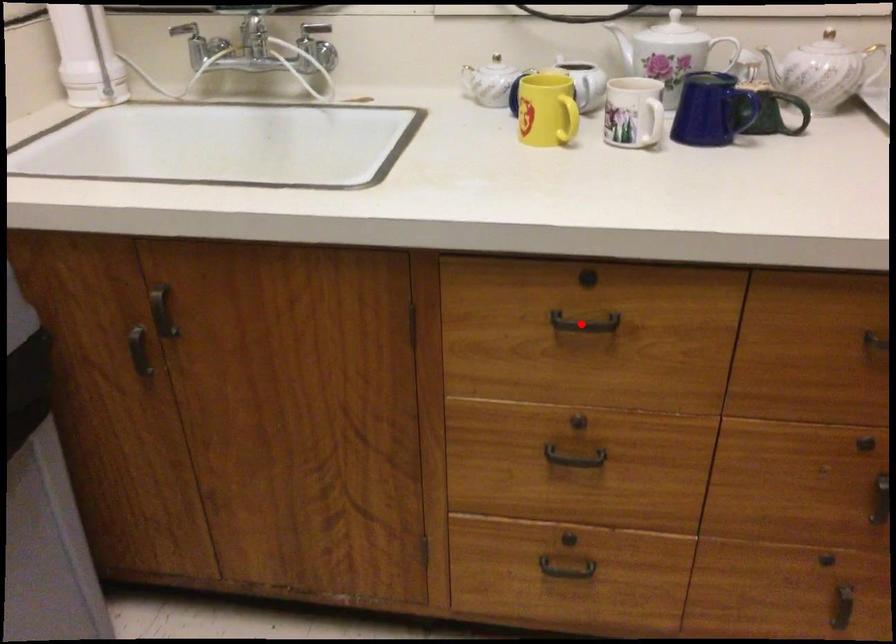
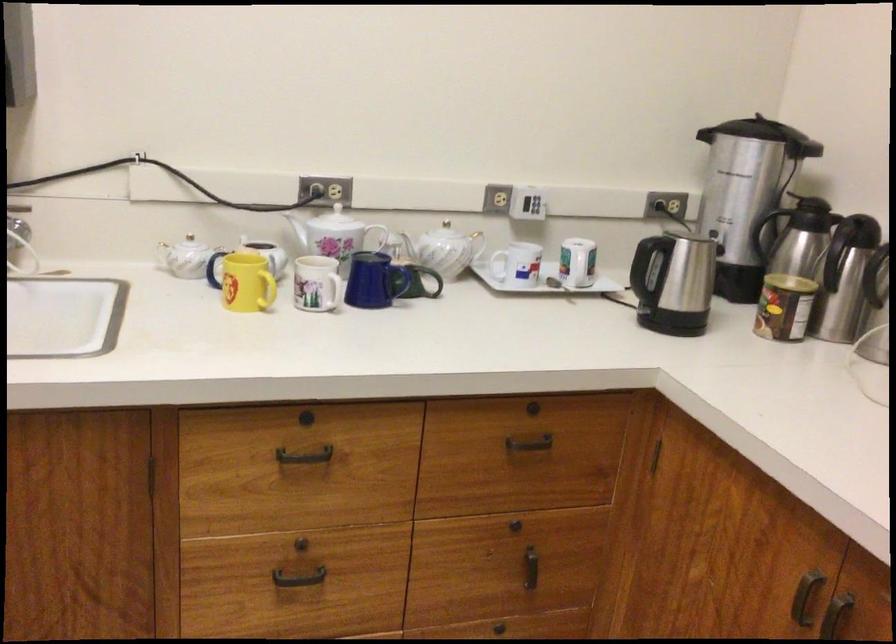
Question: I am providing you with two images of the same scene from different viewpoints. Given a red point in image1, look at the same physical point in image2. Is it:

Choices:
 (A) Closer to the viewpoint
 (B) Farther from the viewpoint

Answer: (B)